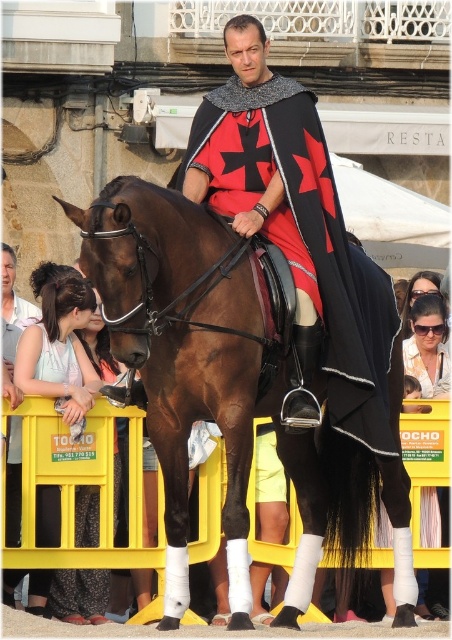
Can you confirm if brown glossy horse at center is positioned below matte black cape at center?

Correct, brown glossy horse at center is located below matte black cape at center.

Does point (180, 413) lie behind point (316, 125)?

No, it is not.

Is point (208, 314) farther from camera compared to point (314, 413)?

No, it is in front of (314, 413).

Identify the location of brown glossy horse at center. The width and height of the screenshot is (452, 640). (227, 388).